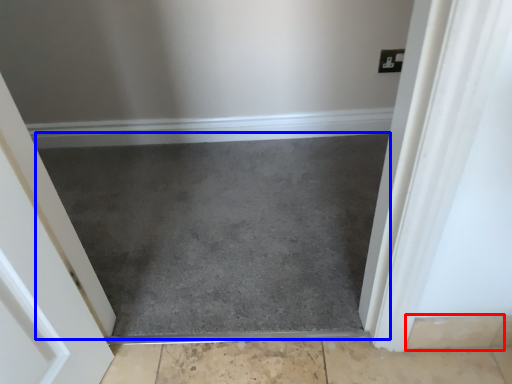
Question: Which point is further to the camera, concrete (highlighted by a red box) or slate (highlighted by a blue box)?

Choices:
 (A) concrete
 (B) slate

Answer: (B)